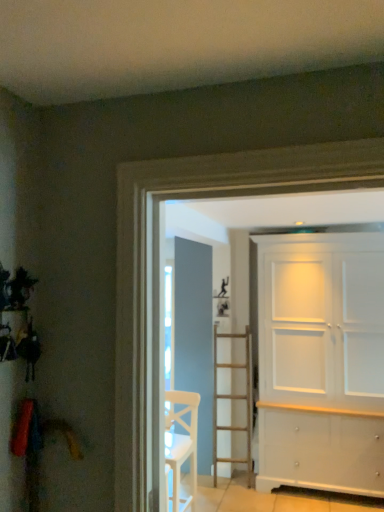
Question: Is point (195, 465) closer or farther from the camera than point (312, 352)?

Choices:
 (A) farther
 (B) closer

Answer: (B)

Question: Choose the correct answer: Is white wooden chair at center inside white painted wood cabinet at right or outside it?

Choices:
 (A) inside
 (B) outside

Answer: (B)

Question: From their relative heights in the image, would you say white wooden chair at center is taller or shorter than white painted wood cabinet at right?

Choices:
 (A) tall
 (B) short

Answer: (B)

Question: Based on their sizes in the image, would you say white painted wood cabinet at right is bigger or smaller than white wooden chair at center?

Choices:
 (A) small
 (B) big

Answer: (B)

Question: Considering the positions of point (375, 388) and point (173, 458), is point (375, 388) closer or farther from the camera than point (173, 458)?

Choices:
 (A) farther
 (B) closer

Answer: (A)

Question: Is white painted wood cabinet at right wider or thinner than white wooden chair at center?

Choices:
 (A) thin
 (B) wide

Answer: (B)

Question: From the image's perspective, is white painted wood cabinet at right above or below white wooden chair at center?

Choices:
 (A) below
 (B) above

Answer: (B)